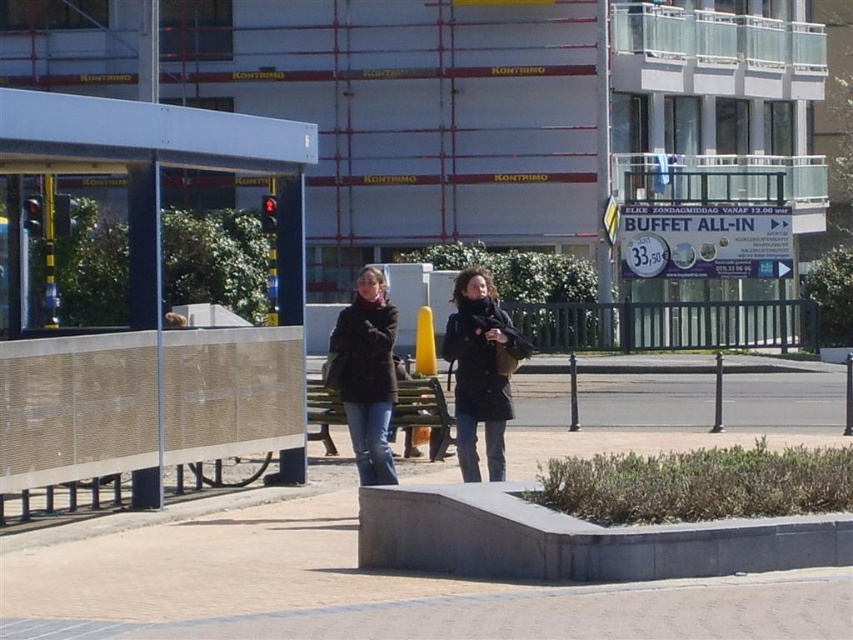
You are a pedestrian standing at the edge of the pathway. You see the metallic silver bus stop at left and the dark brown leather jacket at center. Which object is closer to you?

The dark brown leather jacket at center is closer to you because the metallic silver bus stop at left is positioned over it, indicating it is further away.

You are standing at the bus stop shelter and want to sit down. The bus stop has a bench nearby. Which object, the dark brown leather jacket at center or the wooden park bench at center, is closer to you?

The dark brown leather jacket at center is closer to the viewer than the wooden park bench at center, so you should move towards the dark brown leather jacket at center to reach the bench.

You are a city planner analyzing pedestrian flow. You notice the metallic silver bus stop at left and the dark brown leather jacket at center. Which object takes up more space in the scene?

The dark brown leather jacket at center occupies more space than the metallic silver bus stop at left according to the description.